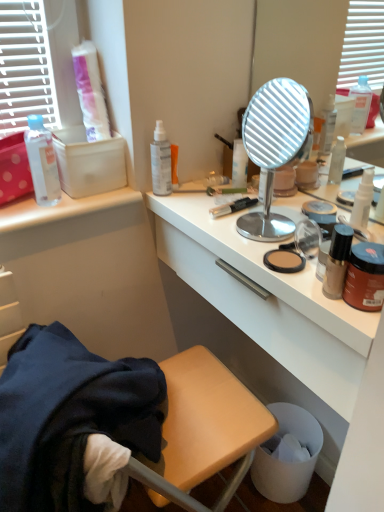
This screenshot has width=384, height=512. I want to click on free location to the right of transparent plastic spray bottle at upper center, which ranks as the 3th bottle in right-to-left order, so click(211, 198).